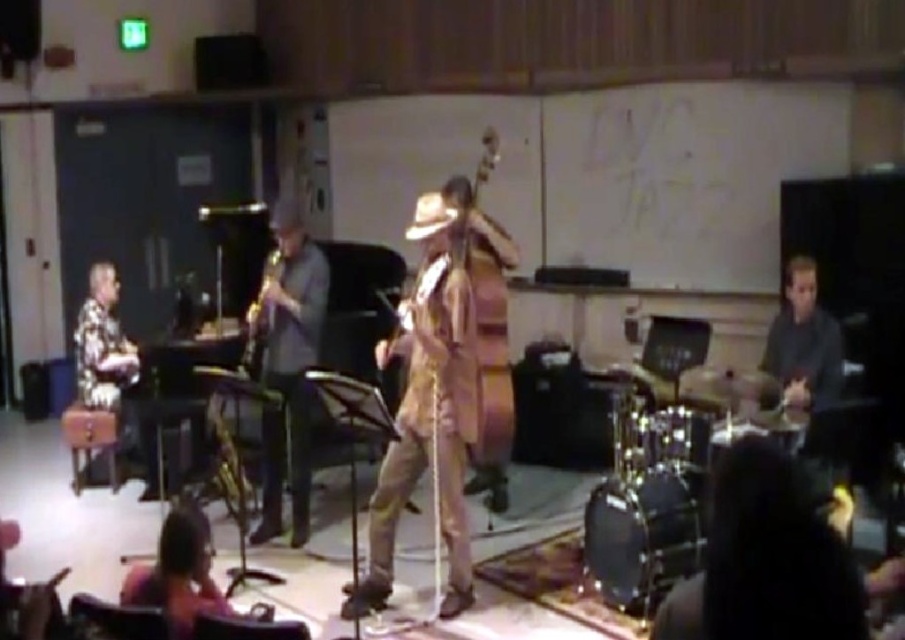
You are attending the jazz performance and notice the black leather jacket at lower right and the gold metallic saxophone at center. Which object is closer to the audience?

The black leather jacket at lower right is closer to the audience because it is in front of the gold metallic saxophone at center.